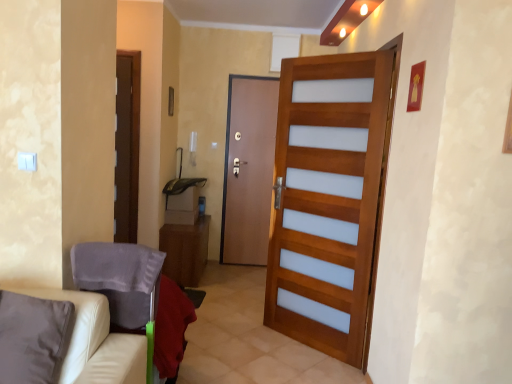
Identify the location of vacant space behind wooden door at center, which appears as the 1th door when viewed from the right. click(270, 330).